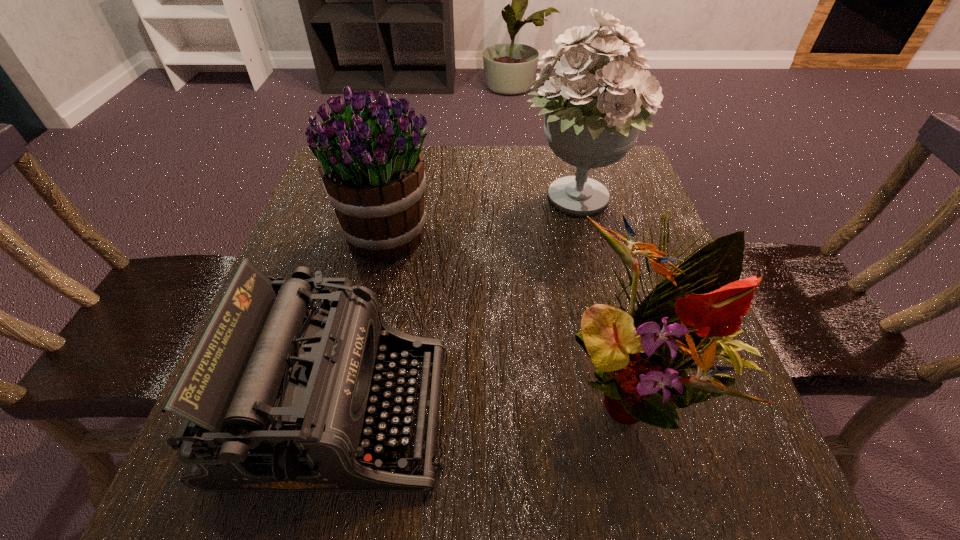
Identify the location of bouquet positioned at the left edge. This screenshot has height=540, width=960. (372, 168).

Locate an element on the screen. typewriter situated at the left edge is located at coordinates (277, 396).

At what (x,y) coordinates should I click in order to perform the action: click on object that is positioned at the near left corner. Please return your answer as a coordinate pair (x, y). The width and height of the screenshot is (960, 540). Looking at the image, I should click on (277, 396).

In order to click on object at the far right corner in this screenshot , I will do `click(591, 122)`.

You are a GUI agent. You are given a task and a screenshot of the screen. Output one action in this format:
    pyautogui.click(x=<x>, y=<y>)
    Task: Click on the object located at the near right corner
    
    Given the screenshot: What is the action you would take?
    pyautogui.click(x=692, y=314)

I want to click on vacant space at the far edge of the desktop, so click(x=497, y=149).

Locate an element on the screen. Image resolution: width=960 pixels, height=540 pixels. vacant position at the left edge of the desktop is located at coordinates (328, 213).

This screenshot has height=540, width=960. In the image, there is a desktop. Find the location of `free space at the right edge`. free space at the right edge is located at coordinates (658, 228).

Find the location of `vacant area at the far right corner of the desktop`. vacant area at the far right corner of the desktop is located at coordinates (641, 188).

Identify the location of free spot at the near right corner of the desktop. The height and width of the screenshot is (540, 960). (698, 479).